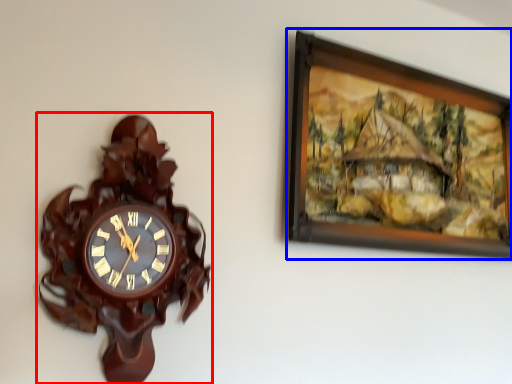
Question: Among these objects, which one is farthest to the camera, wall clock (highlighted by a red box) or picture frame (highlighted by a blue box)?

Choices:
 (A) wall clock
 (B) picture frame

Answer: (B)